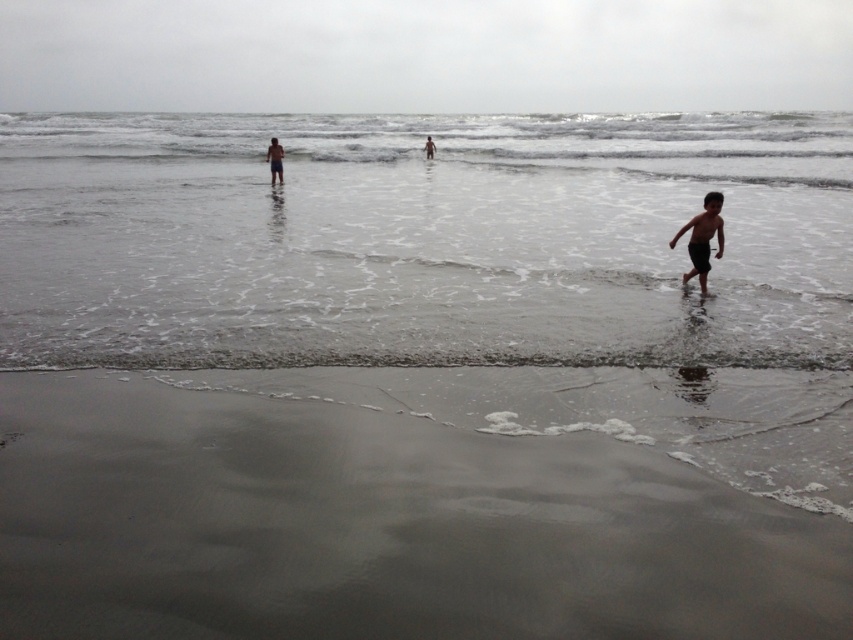
You are a lifeguard on duty and notice two people in the water. One is in clear water at center and the other is smooth skin human at center. Which individual is closer to the surface of the water?

The clear water at center is above smooth skin human at center, so the clear water at center is closer to the surface of the water.

Based on the photo, you are standing at the point marked by the coordinates point (376, 528). Which direction should you walk to reach the sandy beach at lower left?

The point marked by the coordinates point (376, 528) is already located at the sandy beach at lower left, so you are already there.